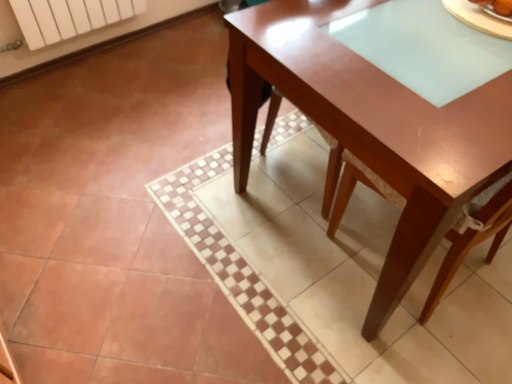
Question: Can you confirm if smooth brown bread at upper right is positioned to the left of glossy wood table at center?

Choices:
 (A) yes
 (B) no

Answer: (A)

Question: From the image's perspective, is smooth brown bread at upper right under glossy wood table at center?

Choices:
 (A) yes
 (B) no

Answer: (B)

Question: Could you tell me if smooth brown bread at upper right is turned towards glossy wood table at center?

Choices:
 (A) yes
 (B) no

Answer: (B)

Question: Considering the relative sizes of smooth brown bread at upper right and glossy wood table at center in the image provided, is smooth brown bread at upper right taller than glossy wood table at center?

Choices:
 (A) no
 (B) yes

Answer: (A)

Question: Can we say smooth brown bread at upper right lies outside glossy wood table at center?

Choices:
 (A) no
 (B) yes

Answer: (A)

Question: Considering their positions, is glossy wood table at center located in front of or behind white matte radiator at upper left?

Choices:
 (A) front
 (B) behind

Answer: (A)

Question: Visually, is glossy wood table at center positioned to the left or to the right of white matte radiator at upper left?

Choices:
 (A) right
 (B) left

Answer: (A)

Question: From the image's perspective, is glossy wood table at center positioned above or below white matte radiator at upper left?

Choices:
 (A) above
 (B) below

Answer: (B)

Question: Does point (x=436, y=145) appear closer or farther from the camera than point (x=28, y=29)?

Choices:
 (A) farther
 (B) closer

Answer: (B)

Question: Would you say glossy wood table at center is inside or outside smooth brown bread at upper right?

Choices:
 (A) inside
 (B) outside

Answer: (B)

Question: In the image, is glossy wood table at center on the left side or the right side of smooth brown bread at upper right?

Choices:
 (A) right
 (B) left

Answer: (A)

Question: Is glossy wood table at center wider or thinner than smooth brown bread at upper right?

Choices:
 (A) wide
 (B) thin

Answer: (A)

Question: From a real-world perspective, is glossy wood table at center positioned above or below smooth brown bread at upper right?

Choices:
 (A) below
 (B) above

Answer: (A)

Question: Considering the positions of smooth brown bread at upper right and white matte radiator at upper left in the image, is smooth brown bread at upper right bigger or smaller than white matte radiator at upper left?

Choices:
 (A) big
 (B) small

Answer: (B)

Question: Do you think smooth brown bread at upper right is within white matte radiator at upper left, or outside of it?

Choices:
 (A) inside
 (B) outside

Answer: (B)